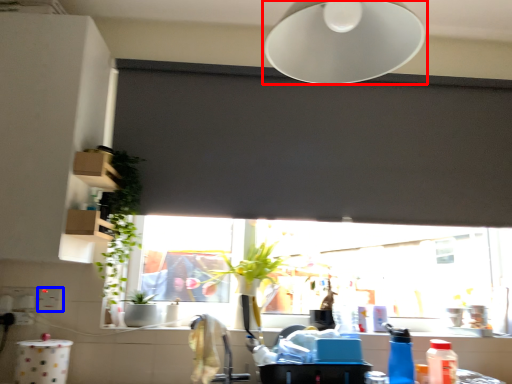
Question: Which object is further to the camera taking this photo, lamp (highlighted by a red box) or electric outlet (highlighted by a blue box)?

Choices:
 (A) lamp
 (B) electric outlet

Answer: (B)